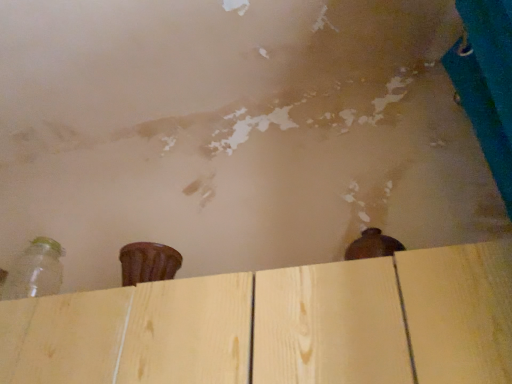
Question: Is natural wood plywood at center situated inside transparent glass bottle at lower left or outside?

Choices:
 (A) outside
 (B) inside

Answer: (A)

Question: Does point (355, 327) appear closer or farther from the camera than point (38, 238)?

Choices:
 (A) closer
 (B) farther

Answer: (A)

Question: Based on their positions, is natural wood plywood at center located to the left or right of transparent glass bottle at lower left?

Choices:
 (A) left
 (B) right

Answer: (B)

Question: Is point (37, 294) positioned closer to the camera than point (313, 362)?

Choices:
 (A) closer
 (B) farther

Answer: (B)

Question: Relative to natural wood plywood at center, is transparent glass bottle at lower left in front or behind?

Choices:
 (A) front
 (B) behind

Answer: (B)

Question: Based on their positions, is transparent glass bottle at lower left located to the left or right of natural wood plywood at center?

Choices:
 (A) left
 (B) right

Answer: (A)

Question: Considering the positions of transparent glass bottle at lower left and natural wood plywood at center in the image, is transparent glass bottle at lower left wider or thinner than natural wood plywood at center?

Choices:
 (A) thin
 (B) wide

Answer: (A)